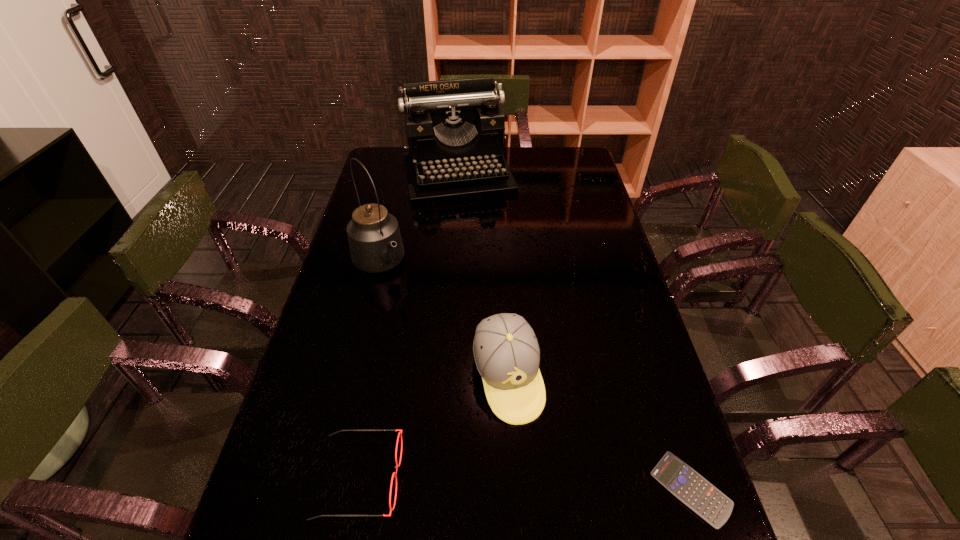
Locate an element on the screen. This screenshot has height=540, width=960. free space that is in between the third tallest object and the rightmost object is located at coordinates (599, 433).

What are the coordinates of `vacant area that lies between the spectacles and the third farthest object` in the screenshot? It's located at (434, 427).

You are a GUI agent. You are given a task and a screenshot of the screen. Output one action in this format:
    pyautogui.click(x=<x>, y=<y>)
    Task: Click on the object that is the second closest one to the second farthest object
    This screenshot has height=540, width=960.
    Given the screenshot: What is the action you would take?
    (x=506, y=352)

Choose which object is the fourth nearest neighbor to the calculator. Please provide its 2D coordinates. Your answer should be formatted as a tuple, i.e. [(x, y)], where the tuple contains the x and y coordinates of a point satisfying the conditions above.

[(455, 129)]

Where is `free space that satisfies the following two spatial constraints: 1. on the front side of the third shortest object; 2. on the right side of the kettle`? The width and height of the screenshot is (960, 540). free space that satisfies the following two spatial constraints: 1. on the front side of the third shortest object; 2. on the right side of the kettle is located at coordinates (352, 377).

At what (x,y) coordinates should I click in order to perform the action: click on free space that satisfies the following two spatial constraints: 1. on the front side of the farthest object; 2. on the right side of the calculator. Please return your answer as a coordinate pair (x, y). The height and width of the screenshot is (540, 960). Looking at the image, I should click on (436, 489).